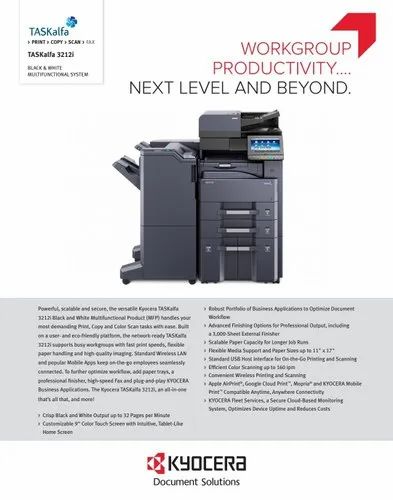
The image size is (393, 500). In order to click on lcd panel in this screenshot , I will do `click(266, 145)`.